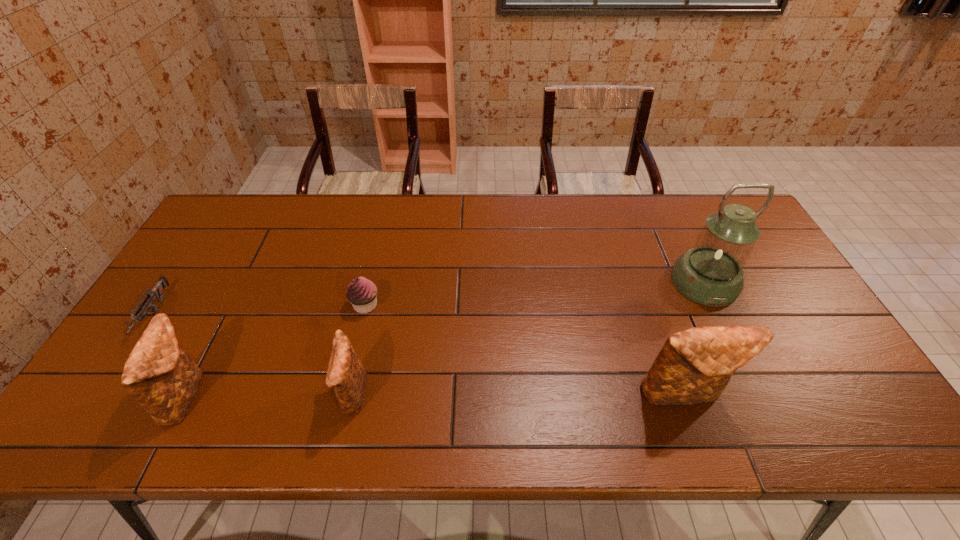
Identify the location of free location located on the open side of the fourth shortest object. (301, 395).

Image resolution: width=960 pixels, height=540 pixels. Identify the location of vacant space located on the open side of the shortest clutch bag. (228, 395).

This screenshot has width=960, height=540. I want to click on free space located 0.090m on the open side of the shortest clutch bag, so click(300, 395).

Find the location of a particular element. The image size is (960, 540). free region located on the open side of the shortest clutch bag is located at coordinates (270, 395).

Identify the location of vacant space located on the back of the lantern. Image resolution: width=960 pixels, height=540 pixels. (x=662, y=194).

Locate an element on the screen. This screenshot has width=960, height=540. free spot located 0.150m on the front of the cupcake is located at coordinates (351, 363).

At what (x,y) coordinates should I click in order to perform the action: click on free spot located 0.150m aimed along the barrel of the shortest object. Please return your answer as a coordinate pair (x, y). Looking at the image, I should click on (97, 398).

What are the coordinates of `object that is at the left edge` in the screenshot? It's located at (156, 292).

You are a GUI agent. You are given a task and a screenshot of the screen. Output one action in this format:
    pyautogui.click(x=<x>, y=<y>)
    Task: Click on the object located at the right edge
    The image size is (960, 540).
    Given the screenshot: What is the action you would take?
    pyautogui.click(x=711, y=273)

In the image, there is a desktop. Find the location of `free space at the far edge`. free space at the far edge is located at coordinates (604, 194).